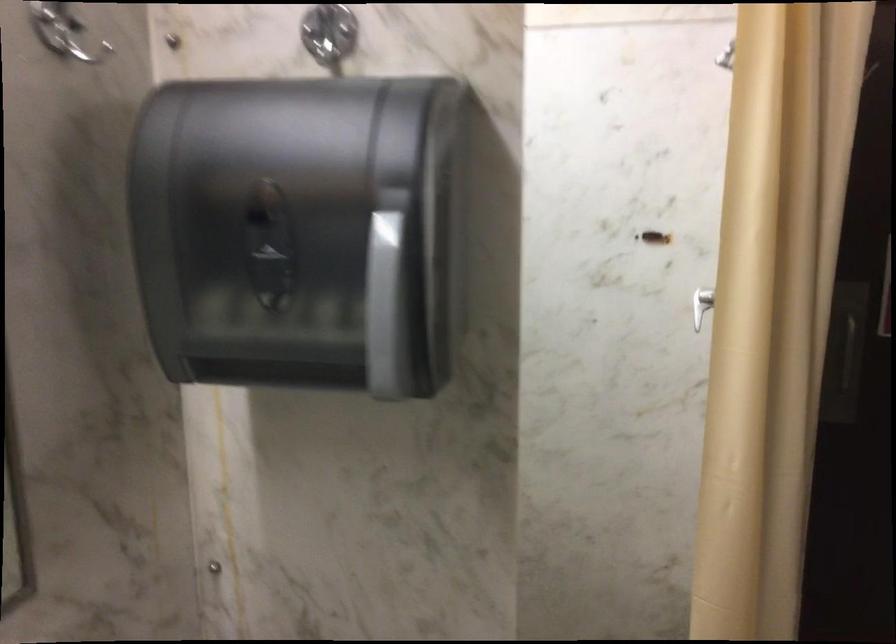
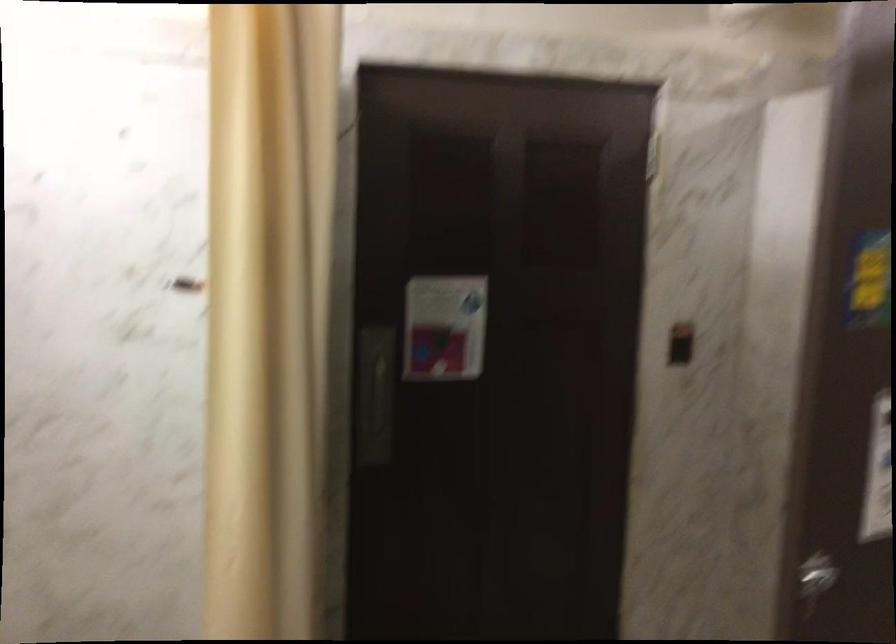
Question: The first image is from the beginning of the video and the second image is from the end. How did the camera likely rotate when shooting the video?

Choices:
 (A) Left
 (B) Right
 (C) Up
 (D) Down

Answer: (B)